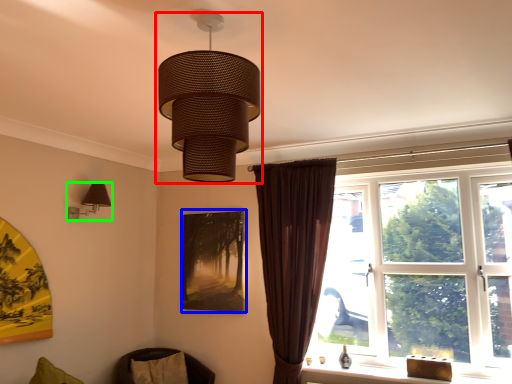
Question: Based on their relative distances, which object is nearer to lamp (highlighted by a red box)? Choose from picture frame (highlighted by a blue box) and lamp (highlighted by a green box).

Choices:
 (A) picture frame
 (B) lamp

Answer: (B)